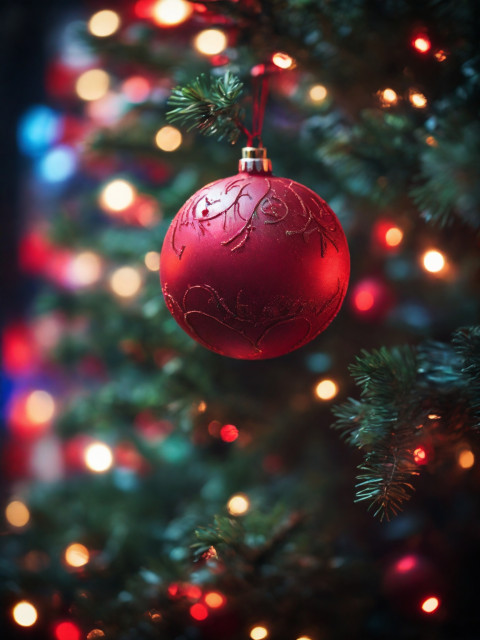
Find the location of a particular element. ornament holder is located at coordinates (251, 152).